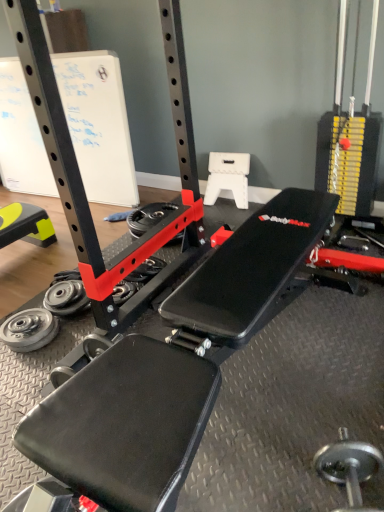
I want to click on vacant space behind silver metallic dumbbell at lower right, so click(x=316, y=423).